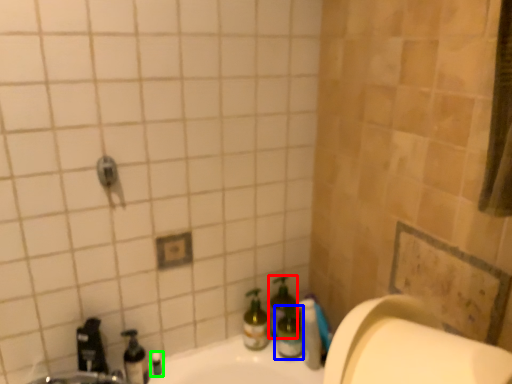
Question: Which is nearer to the bottle (highlighted by a red box)? bottle (highlighted by a blue box) or toiletry (highlighted by a green box).

Choices:
 (A) bottle
 (B) toiletry

Answer: (A)